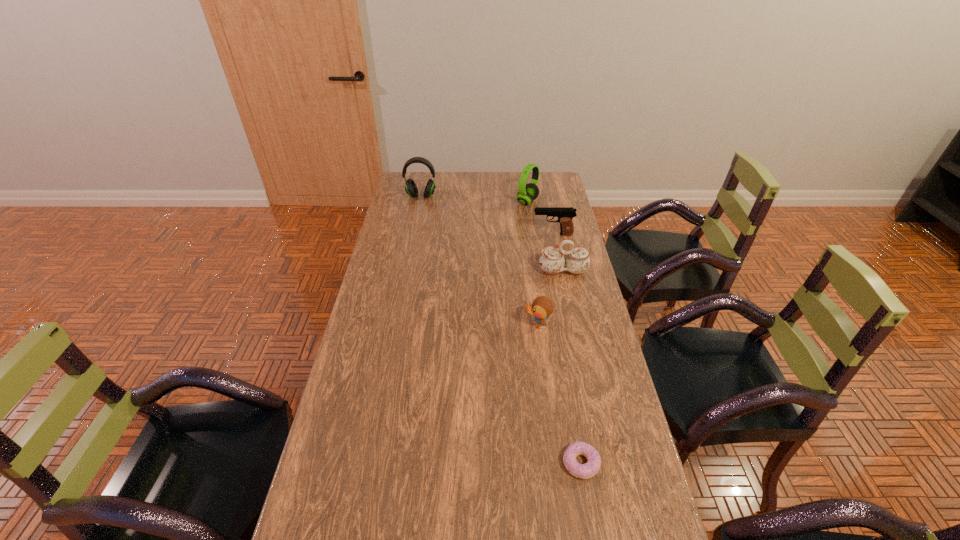
Where is `the left headset`? the left headset is located at coordinates (411, 189).

Locate an element on the screen. The image size is (960, 540). the right headset is located at coordinates (527, 193).

Image resolution: width=960 pixels, height=540 pixels. Find the location of `the third nearest object`. the third nearest object is located at coordinates (552, 261).

Identify the location of pistol. The width and height of the screenshot is (960, 540). (565, 215).

I want to click on duck, so click(542, 307).

I want to click on doughnut, so click(583, 471).

I want to click on the shortest object, so click(583, 471).

Identify the location of free spot located 0.340m on the ear cups of the left headset. This screenshot has width=960, height=540. (412, 245).

Identify the location of vacant region located 0.160m on the back of the right headset. This screenshot has width=960, height=540. (524, 178).

In order to click on vacant region located 0.310m by the handle of the chinaware in this screenshot , I will do `click(579, 343)`.